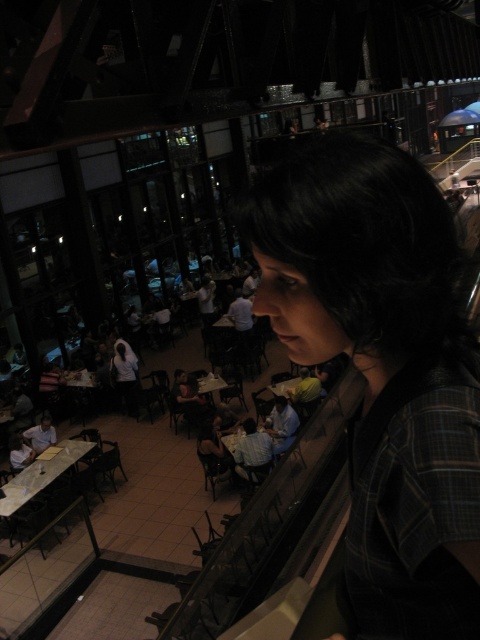
Question: Does wooden table at center have a smaller size compared to white glossy table at center?

Choices:
 (A) yes
 (B) no

Answer: (A)

Question: Estimate the real-world distances between objects in this image. Which object is closer to the wooden table at center?

Choices:
 (A) white glossy table at lower left
 (B) white glossy table at center
 (C) plaid fabric shirt at center

Answer: (B)

Question: Which of these objects is positioned farthest from the white glossy table at lower left?

Choices:
 (A) wooden table at center
 (B) plaid fabric shirt at center

Answer: (B)

Question: Can you confirm if white glossy table at lower left is positioned above white glossy table at center?

Choices:
 (A) no
 (B) yes

Answer: (A)

Question: Can you confirm if plaid fabric shirt at center is positioned to the right of wooden table at center?

Choices:
 (A) no
 (B) yes

Answer: (B)

Question: Which point is farther from the camera taking this photo?

Choices:
 (A) (358, 493)
 (B) (200, 385)

Answer: (B)